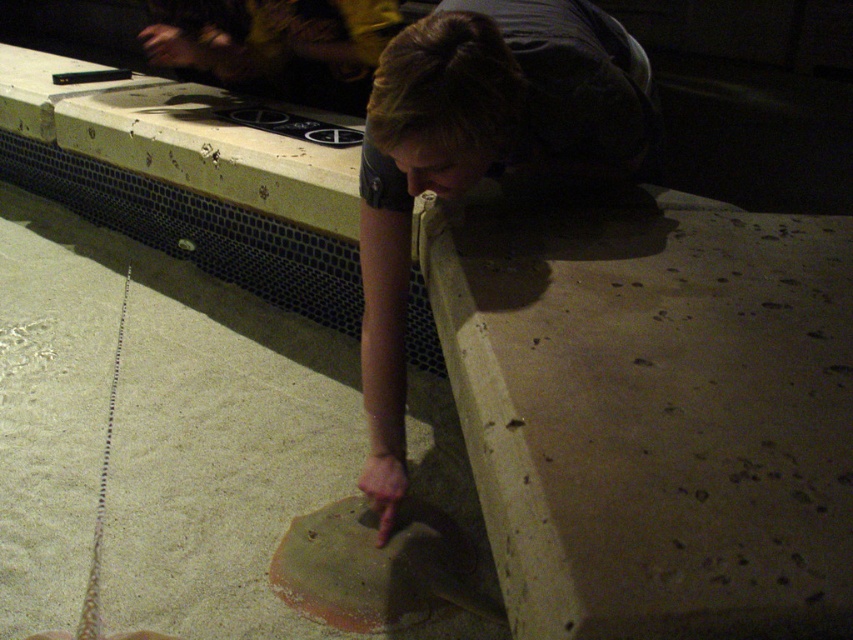
You are standing in a park and see a smooth concrete slab at lower right. If you take one large step forward, will you be able to touch it?

The smooth concrete slab at lower right is 31.44 inches away from viewer. Since one large step is typically around 30 inches, you might need to take one full step to reach it, but it depends on your stride length.

You are standing in the scene and see two points marked on the concrete surface. Which point is closer to you, point (x=93, y=438) or point (x=364, y=355)?

Point (x=93, y=438) is closer to you because it is further to the viewer than point (x=364, y=355).